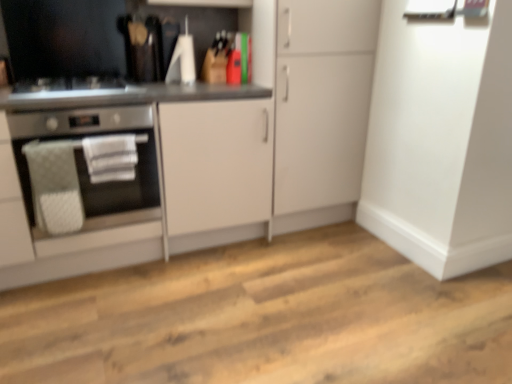
Question: Which is correct: satin black gas stove at left is inside matte white cabinet at center, which ranks as the second cabinetry in right-to-left order, or outside of it?

Choices:
 (A) inside
 (B) outside

Answer: (A)

Question: In the image, is satin black gas stove at left positioned in front of or behind matte white cabinet at center, which ranks as the second cabinetry in right-to-left order?

Choices:
 (A) front
 (B) behind

Answer: (B)

Question: Estimate the real-world distances between objects in this image. Which object is farther from the stainless steel oven at left?

Choices:
 (A) matte white cabinet at center, which ranks as the second cabinetry in right-to-left order
 (B) satin black gas stove at left
 (C) white matte cabinet at center, the 1th cabinetry viewed from the right

Answer: (C)

Question: Estimate the real-world distances between objects in this image. Which object is farther from the stainless steel oven at left?

Choices:
 (A) satin black gas stove at left
 (B) matte white cabinet at center, which ranks as the second cabinetry in right-to-left order
 (C) white matte cabinet at center, the 1th cabinetry viewed from the right

Answer: (C)